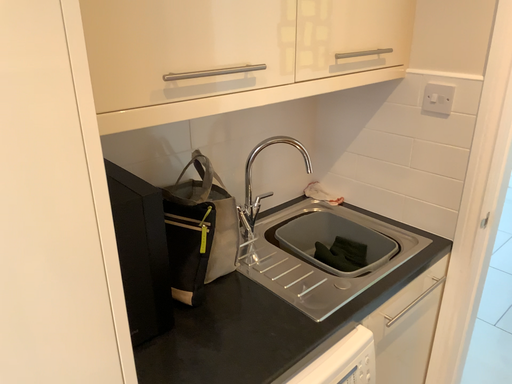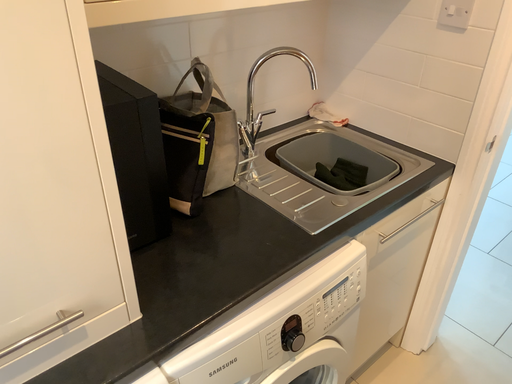
Question: Which way did the camera rotate in the video?

Choices:
 (A) rotated upward
 (B) rotated downward

Answer: (B)